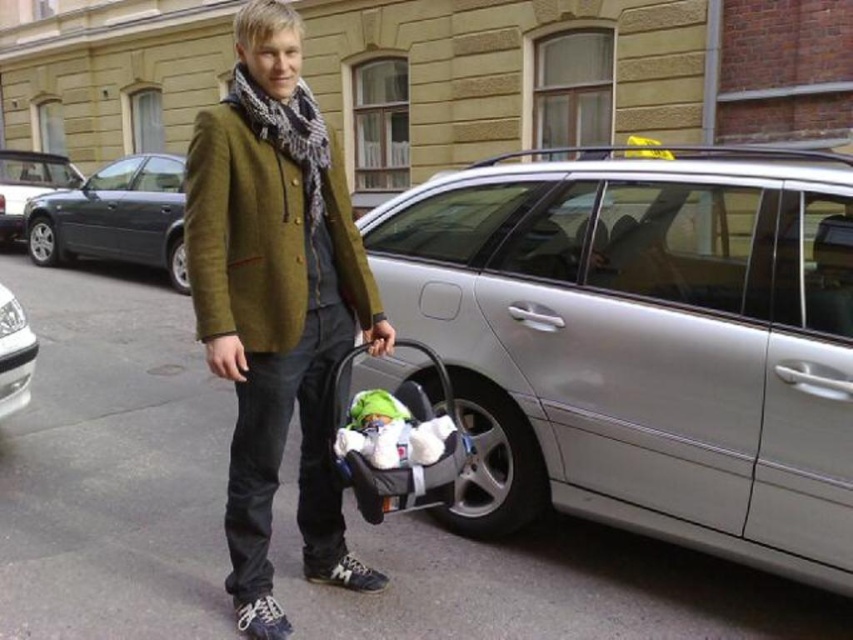
Is point (375, 518) less distant than point (32, 195)?

Yes, point (375, 518) is closer to viewer.

Who is more distant from viewer, (370, 493) or (15, 177)?

The point (15, 177) is behind.

You are a GUI agent. You are given a task and a screenshot of the screen. Output one action in this format:
    pyautogui.click(x=<x>, y=<y>)
    Task: Click on the soft fabric baby carriage at lower center
    The height and width of the screenshot is (640, 853).
    Given the screenshot: What is the action you would take?
    pyautogui.click(x=412, y=468)

Which is in front, point (144, 196) or point (32, 180)?

Point (144, 196) is more forward.

Is point (61, 225) behind point (4, 157)?

No, (61, 225) is closer to viewer.

Identify the location of metallic gray sedan at left. coord(115,218).

Is metallic gray sedan at left taller than soft fabric baby carriage at lower center?

Yes, metallic gray sedan at left is taller than soft fabric baby carriage at lower center.

Is point (113, 227) in front of point (410, 480)?

No.

Does point (45, 230) come closer to viewer compared to point (432, 412)?

No, (45, 230) is behind (432, 412).

You are a GUI agent. You are given a task and a screenshot of the screen. Output one action in this format:
    pyautogui.click(x=<x>, y=<y>)
    Task: Click on the metallic gray sedan at left
    The width and height of the screenshot is (853, 640).
    Given the screenshot: What is the action you would take?
    pyautogui.click(x=115, y=218)